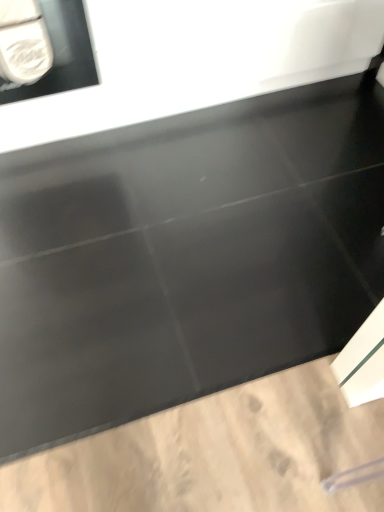
The height and width of the screenshot is (512, 384). What do you see at coordinates (62, 53) in the screenshot?
I see `matte white toilet at upper left` at bounding box center [62, 53].

Find the location of `matte white toilet at upper left`. matte white toilet at upper left is located at coordinates (62, 53).

What are the coordinates of `matte white toilet at upper left` in the screenshot? It's located at (62, 53).